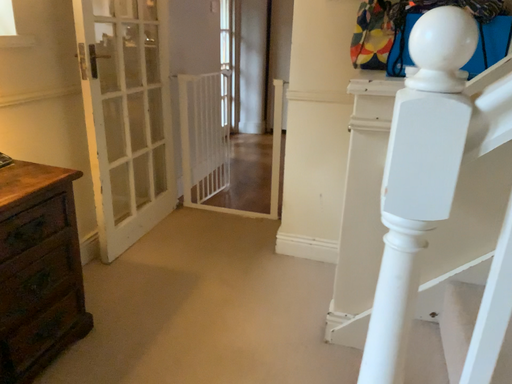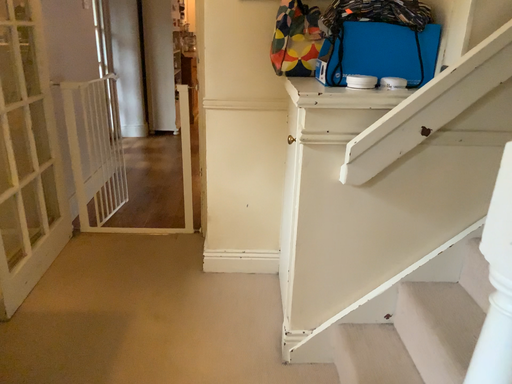
Question: Which way did the camera rotate in the video?

Choices:
 (A) rotated left
 (B) rotated right

Answer: (B)